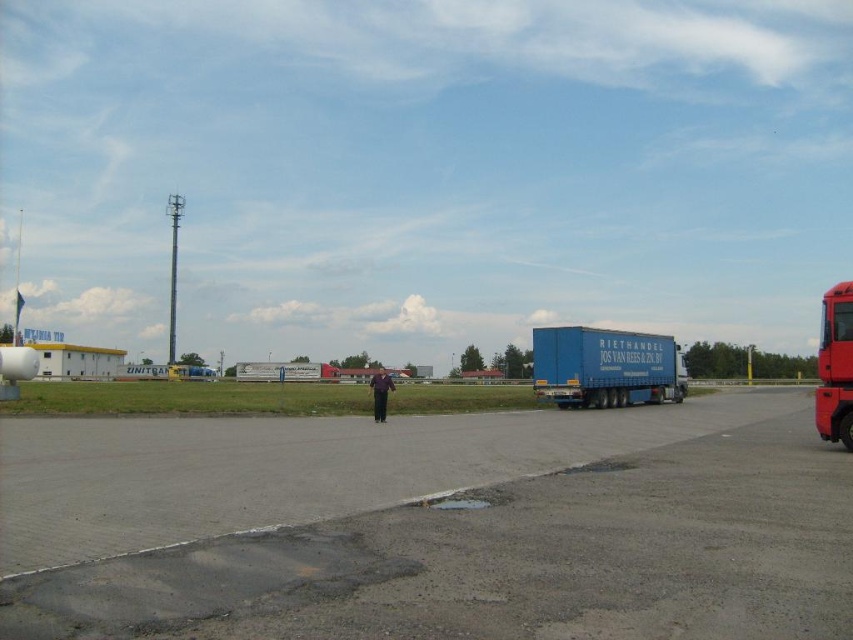
Consider the image. Is blue matte trailer at right shorter than shiny red truck at right?

Yes.

Which is above, blue matte trailer at right or shiny red truck at right?

shiny red truck at right is above.

Which is behind, point (572, 348) or point (837, 368)?

The point (572, 348) is behind.

Where is `blue matte trailer at right`? This screenshot has height=640, width=853. blue matte trailer at right is located at coordinates (605, 365).

Can you confirm if asphalt at center is wider than blue matte trailer at right?

Indeed, asphalt at center has a greater width compared to blue matte trailer at right.

Does asphalt at center appear on the right side of blue matte trailer at right?

No, asphalt at center is not to the right of blue matte trailer at right.

Which is in front, point (709, 582) or point (590, 349)?

Point (709, 582)

Find the location of a particular element. asphalt at center is located at coordinates (430, 525).

The image size is (853, 640). Describe the element at coordinates (430, 525) in the screenshot. I see `asphalt at center` at that location.

Is asphalt at center behind shiny red truck at right?

No.

Does point (96, 560) come closer to viewer compared to point (836, 385)?

Yes.

Identify the location of asphalt at center. This screenshot has width=853, height=640. (430, 525).